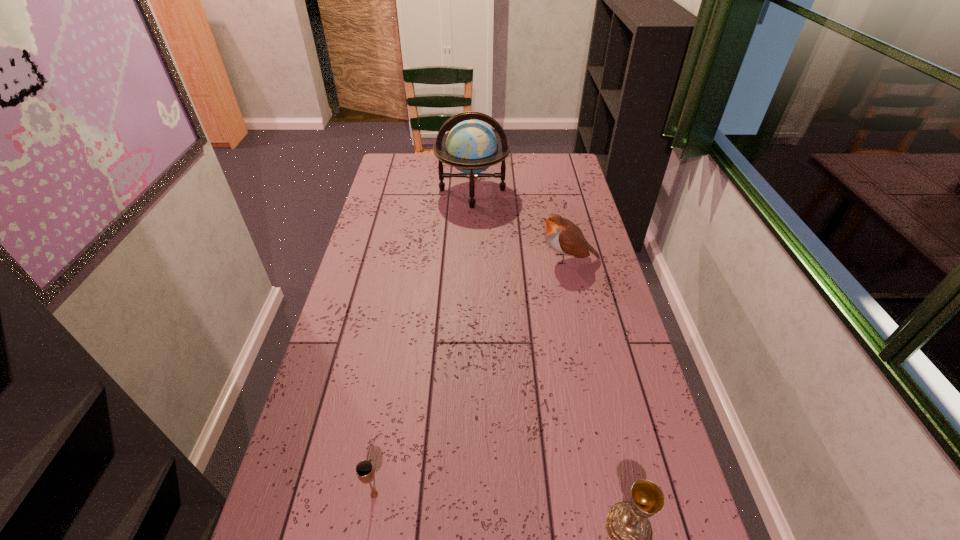
I want to click on the second object from left to right, so click(x=471, y=146).

I want to click on globe, so click(471, 146).

You are a GUI agent. You are given a task and a screenshot of the screen. Output one action in this format:
    pyautogui.click(x=<x>, y=<y>)
    Task: Click on the second farthest object
    The width and height of the screenshot is (960, 540).
    Given the screenshot: What is the action you would take?
    pyautogui.click(x=565, y=237)

You are a GUI agent. You are given a task and a screenshot of the screen. Output one action in this format:
    pyautogui.click(x=<x>, y=<y>)
    Task: Click on the shorter chalice
    
    Given the screenshot: What is the action you would take?
    pyautogui.click(x=365, y=471)

Locate an element on the screen. The height and width of the screenshot is (540, 960). the left chalice is located at coordinates (365, 471).

You are a GUI agent. You are given a task and a screenshot of the screen. Output one action in this format:
    pyautogui.click(x=<x>, y=<y>)
    Task: Click on the vacant space located 0.080m on the surface of the second object from left to right
    
    Given the screenshot: What is the action you would take?
    pyautogui.click(x=471, y=222)

The width and height of the screenshot is (960, 540). What are the coordinates of `vacant space located 0.260m at the face of the second farthest object` in the screenshot? It's located at (464, 259).

The height and width of the screenshot is (540, 960). In order to click on blank space located at the face of the second farthest object in this screenshot , I will do point(506,259).

This screenshot has height=540, width=960. In order to click on vacant region located 0.300m at the face of the second farthest object in this screenshot , I will do `click(453, 259)`.

This screenshot has width=960, height=540. Identify the location of free location located 0.150m on the back of the shorter chalice. (386, 425).